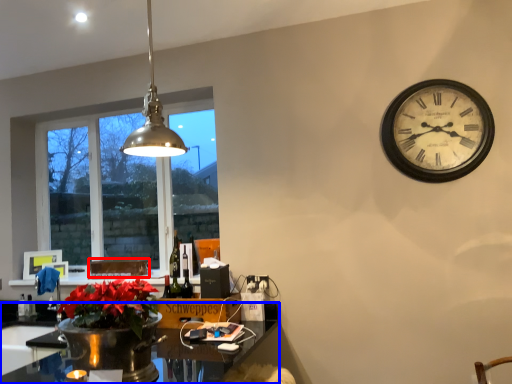
Question: Which object appears farthest to the camera in this image, cardboard box (highlighted by a red box) or desk (highlighted by a blue box)?

Choices:
 (A) cardboard box
 (B) desk

Answer: (A)